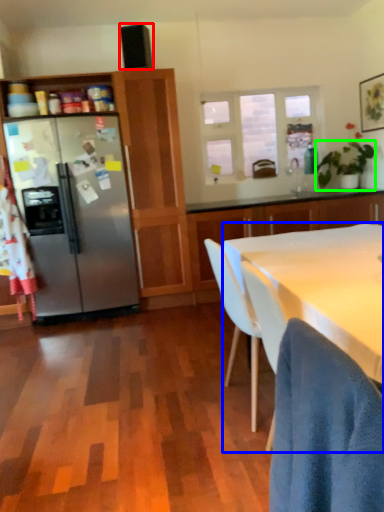
Question: Which is nearer to the loudspeaker (highlighted by a red box)? desk (highlighted by a blue box) or houseplant (highlighted by a green box).

Choices:
 (A) desk
 (B) houseplant

Answer: (B)